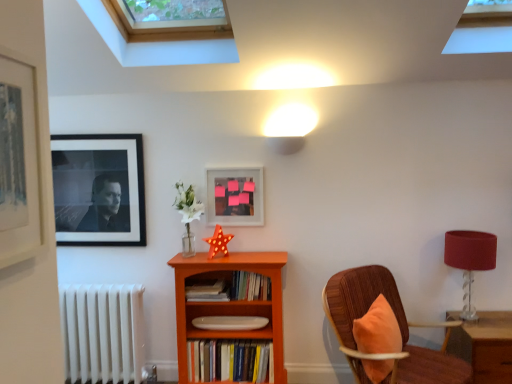
In order to click on free spot above matte black picture frame at upper left, arranged as the third picture frame when viewed from the front (from a real-world perspective) in this screenshot , I will do `click(90, 137)`.